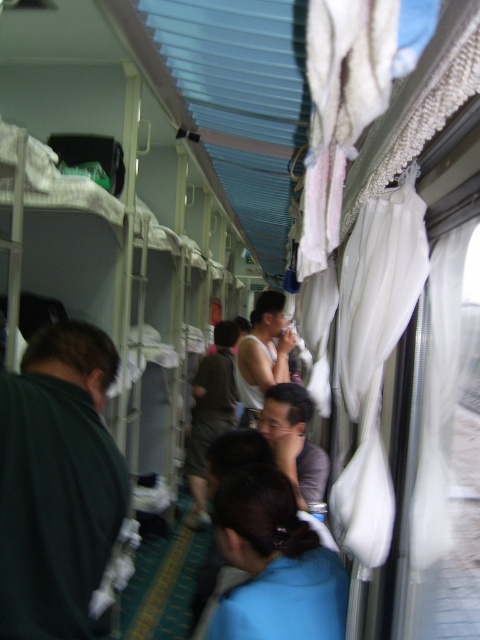
Can you confirm if dark green fabric at left is positioned to the right of white matte tank top at center?

No, dark green fabric at left is not to the right of white matte tank top at center.

Is point (34, 403) closer to camera compared to point (248, 392)?

Yes, it is in front of point (248, 392).

This screenshot has width=480, height=640. I want to click on dark green fabric at left, so click(x=57, y=483).

Between point (215, 365) and point (260, 323), which one is positioned behind?

Point (215, 365)

Which is more to the right, dark green fabric at center or white matte tank top at center?

white matte tank top at center is more to the right.

Is point (216, 333) in front of point (248, 406)?

No, it is behind (248, 406).

Where is `dark green fabric at center`? dark green fabric at center is located at coordinates (211, 412).

Looking at this image, between dark green fabric at left and blue fabric at center, which one appears on the right side from the viewer's perspective?

blue fabric at center is more to the right.

How far apart are dark green fabric at left and blue fabric at center?

The distance of dark green fabric at left from blue fabric at center is 18.51 inches.

Image resolution: width=480 pixels, height=640 pixels. I want to click on dark green fabric at left, so click(x=57, y=483).

Identify the location of dark green fabric at left. Image resolution: width=480 pixels, height=640 pixels. (57, 483).